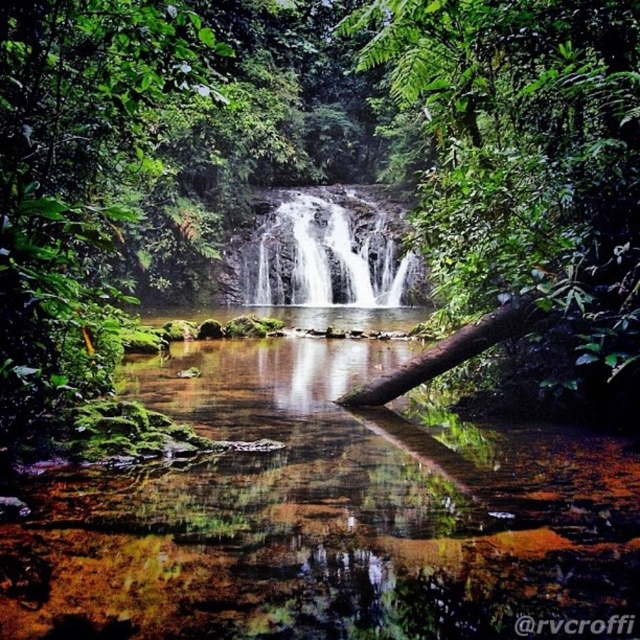
You are a hiker who wants to cross the water using the green rough log at center and the white smooth waterfall at center. Which object is taller and can provide a stable base for crossing?

The green rough log at center is taller than the white smooth waterfall at center, so it can provide a stable base for crossing.

You are a hiker standing at the edge of the pool below the waterfall. You want to take a photo of both the green leafy tree at center and the white smooth waterfall at center. Which object will appear larger in your photo?

The green leafy tree at center will appear larger in the photo because it is closer to the viewer than the white smooth waterfall at center.